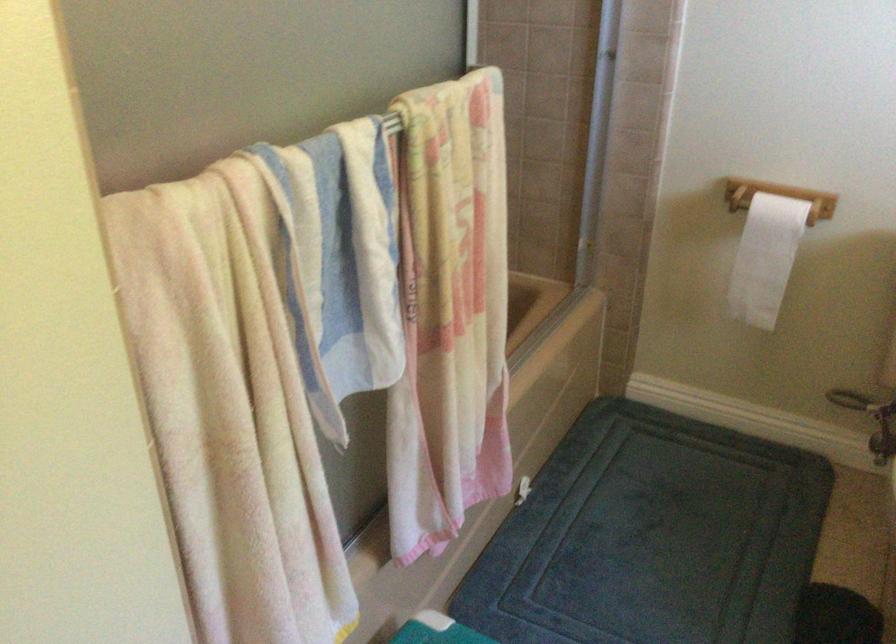
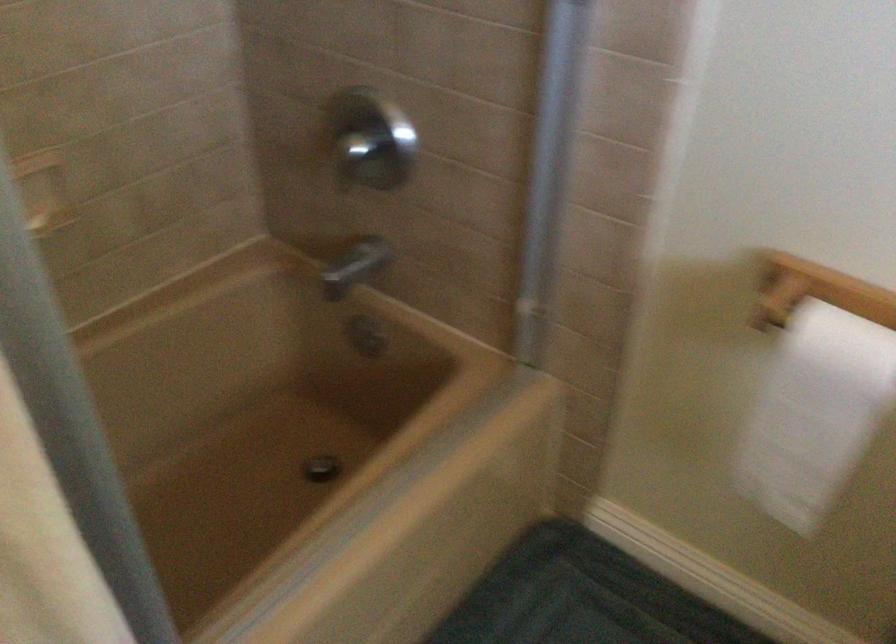
Question: The first image is from the beginning of the video and the second image is from the end. How did the camera likely rotate when shooting the video?

Choices:
 (A) Left
 (B) Right
 (C) Up
 (D) Down

Answer: (D)